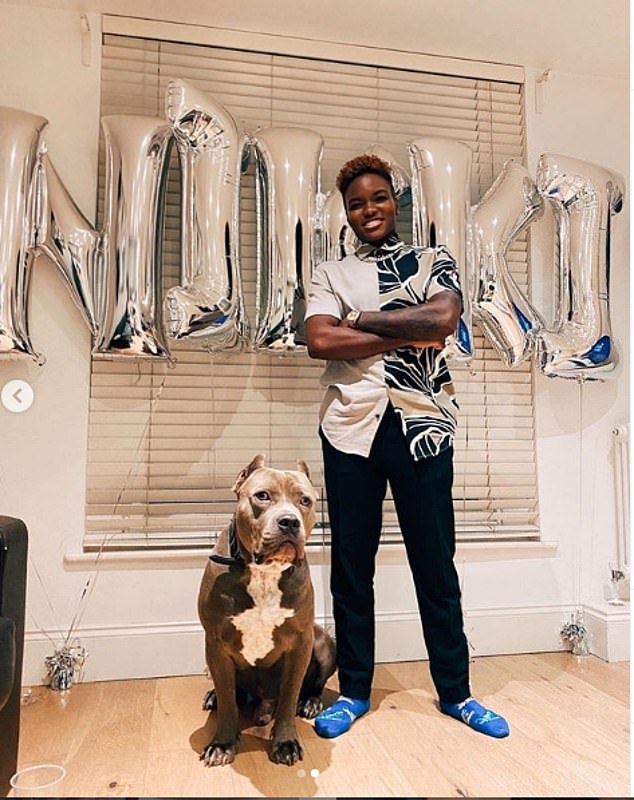
What are the coordinates of `window` in the screenshot? It's located at (451, 514).